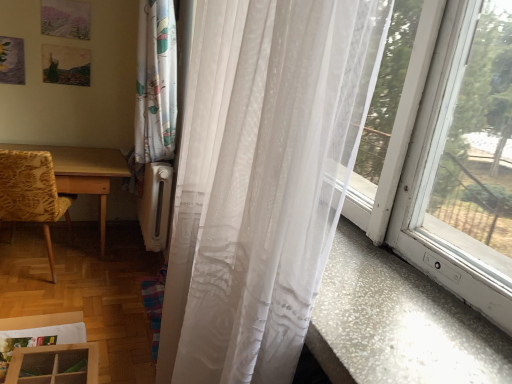
Question: From a real-world perspective, is yellow floral fabric chair at left above or below wooden table at left?

Choices:
 (A) above
 (B) below

Answer: (A)

Question: In terms of size, does yellow floral fabric chair at left appear bigger or smaller than wooden table at left?

Choices:
 (A) small
 (B) big

Answer: (A)

Question: Which object is positioned closest to the translucent white curtain at right?

Choices:
 (A) wooden table at left
 (B) yellow floral fabric chair at left

Answer: (B)

Question: Which is farther from the wooden table at left?

Choices:
 (A) translucent white curtain at right
 (B) yellow floral fabric chair at left

Answer: (A)